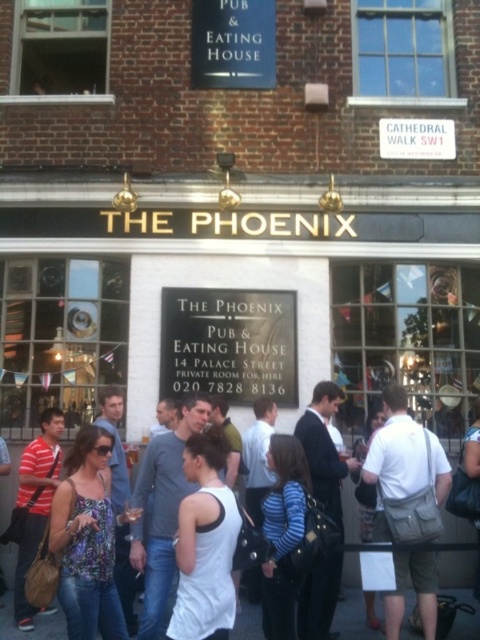
The image size is (480, 640). What do you see at coordinates (228, 344) in the screenshot?
I see `metallic signboard at center` at bounding box center [228, 344].

Image resolution: width=480 pixels, height=640 pixels. Find the location of `metallic signboard at center`. metallic signboard at center is located at coordinates (228, 344).